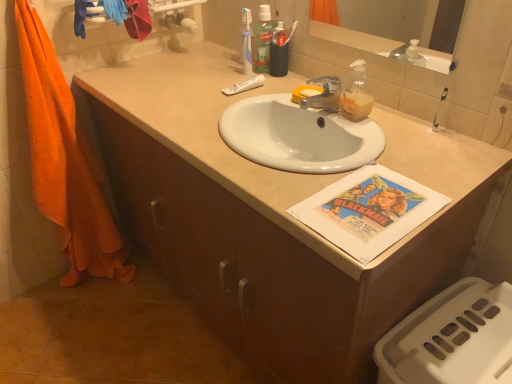
Find the location of `free region on the left part of white matte tube at center`. free region on the left part of white matte tube at center is located at coordinates (196, 91).